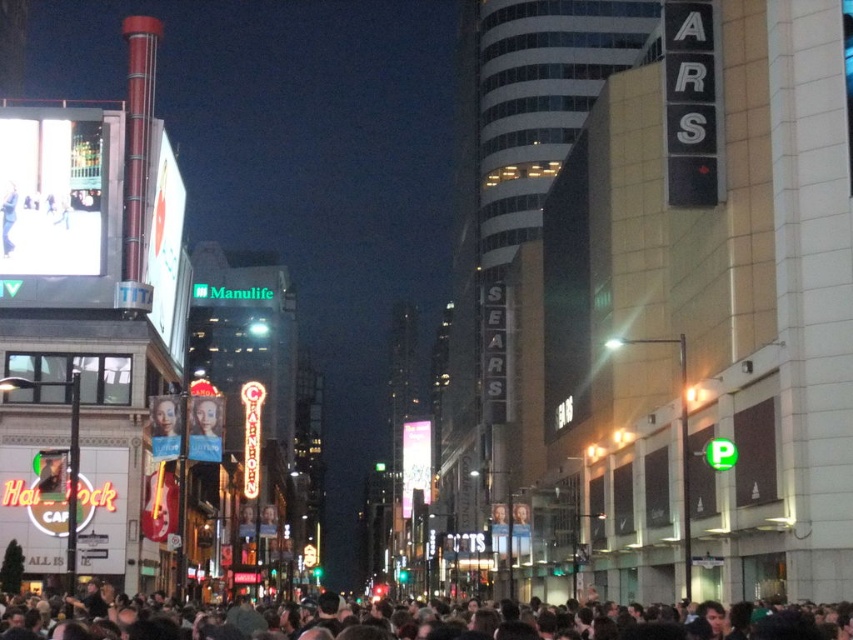
From the picture: You are standing in the bustling urban scene at night. You see a point marked at coordinates (438,621). What is located at this point?

The point at coordinates (438,621) is located on dark brown hair at lower center.

You are standing at the center of the bustling urban scene and want to move towards the point at coordinates point (473, 621) and point (172, 397). Which point is closer to your current position?

Point (473, 621) is in front of point (172, 397), so it is closer to your current position.